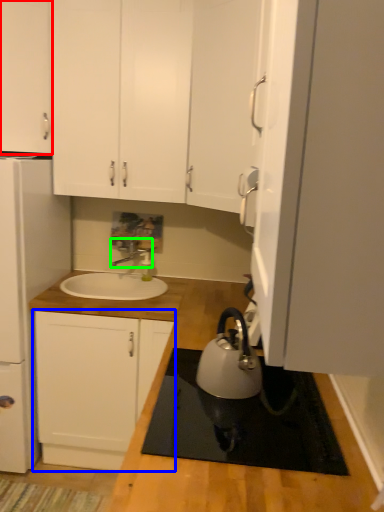
Question: Estimate the real-world distances between objects in this image. Which object is farther from cabinetry (highlighted by a red box), cabinetry (highlighted by a blue box) or tap (highlighted by a green box)?

Choices:
 (A) cabinetry
 (B) tap

Answer: (A)